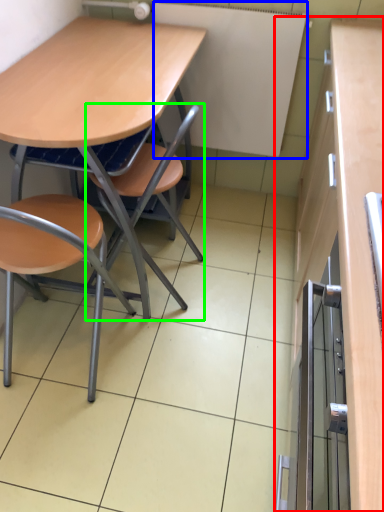
Question: Considering the real-world distances, which object is farthest from cabinetry (highlighted by a red box)? bulletin board (highlighted by a blue box) or chair (highlighted by a green box)?

Choices:
 (A) bulletin board
 (B) chair

Answer: (B)